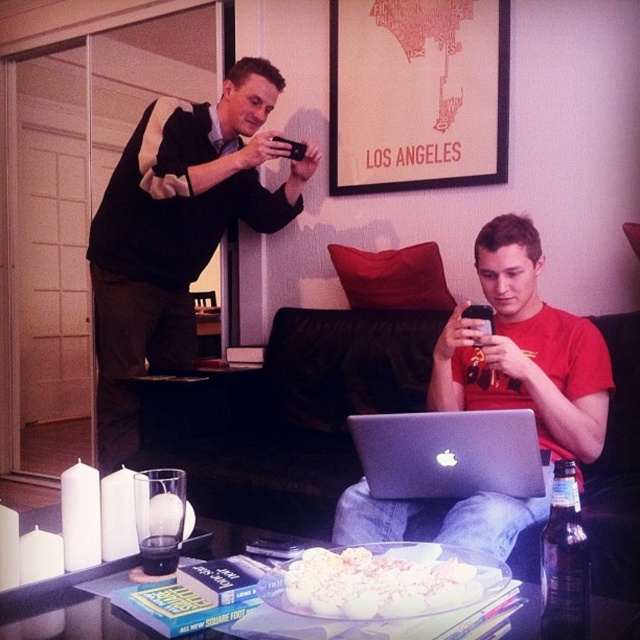
Can you confirm if black leather couch at center is positioned to the left of silver metallic laptop at center?

Indeed, black leather couch at center is positioned on the left side of silver metallic laptop at center.

Can you confirm if black leather couch at center is wider than silver metallic laptop at center?

Indeed, black leather couch at center has a greater width compared to silver metallic laptop at center.

This screenshot has height=640, width=640. Identify the location of black leather couch at center. (288, 416).

Identify the location of black leather couch at center. (288, 416).

Who is higher up, matte red shirt at center or dark brown glass bottle at lower right?

matte red shirt at center is higher up.

The image size is (640, 640). What do you see at coordinates (524, 349) in the screenshot?
I see `matte red shirt at center` at bounding box center [524, 349].

Where is `matte red shirt at center`? The width and height of the screenshot is (640, 640). matte red shirt at center is located at coordinates (524, 349).

Does point (264, 74) lie in front of point (148, 564)?

No.

Between black matte phone at upper left and clear glass at center, which one has more height?

black matte phone at upper left

The width and height of the screenshot is (640, 640). Describe the element at coordinates (177, 230) in the screenshot. I see `black matte phone at upper left` at that location.

You are a GUI agent. You are given a task and a screenshot of the screen. Output one action in this format:
    pyautogui.click(x=<x>, y=<y>)
    Task: Click on the black matte phone at upper left
    This screenshot has width=640, height=640.
    Given the screenshot: What is the action you would take?
    pyautogui.click(x=177, y=230)